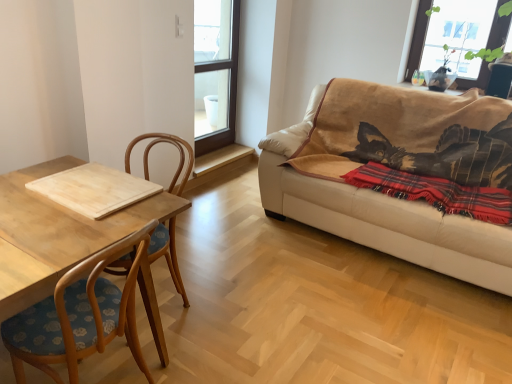
Image resolution: width=512 pixels, height=384 pixels. I want to click on vacant area that lies in front of beige leather couch at right, so click(x=359, y=318).